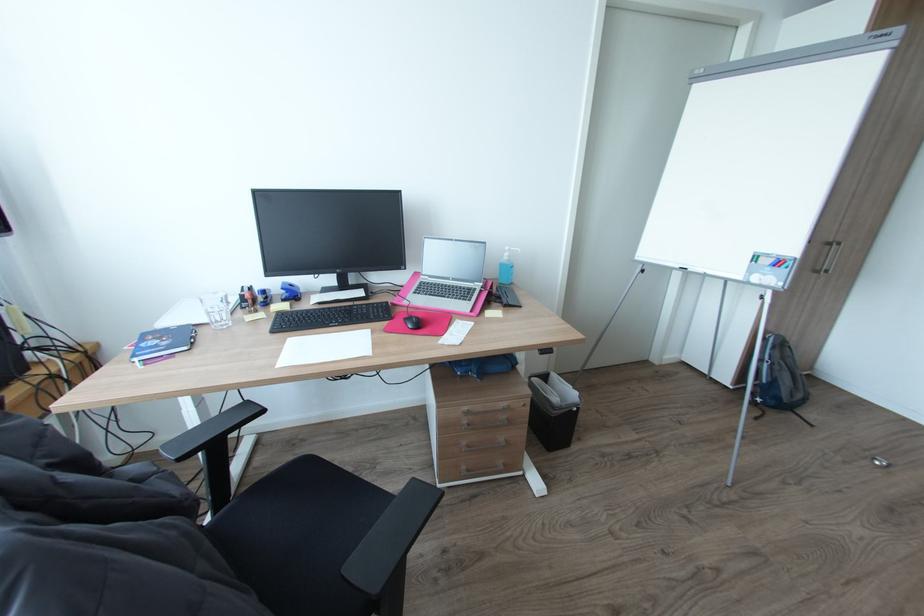
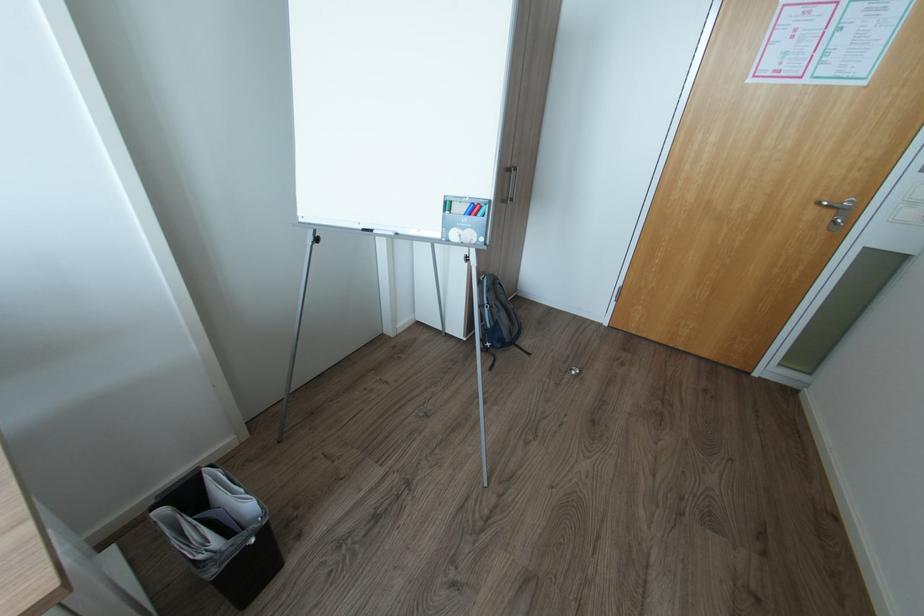
The point at (x=833, y=240) is marked in the first image. Where is the corresponding point in the second image?

(514, 166)